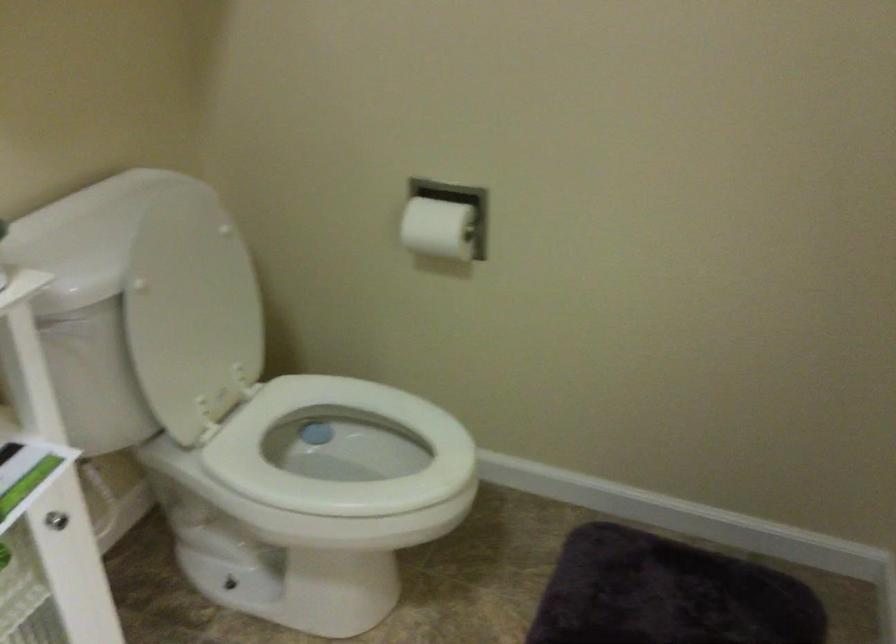
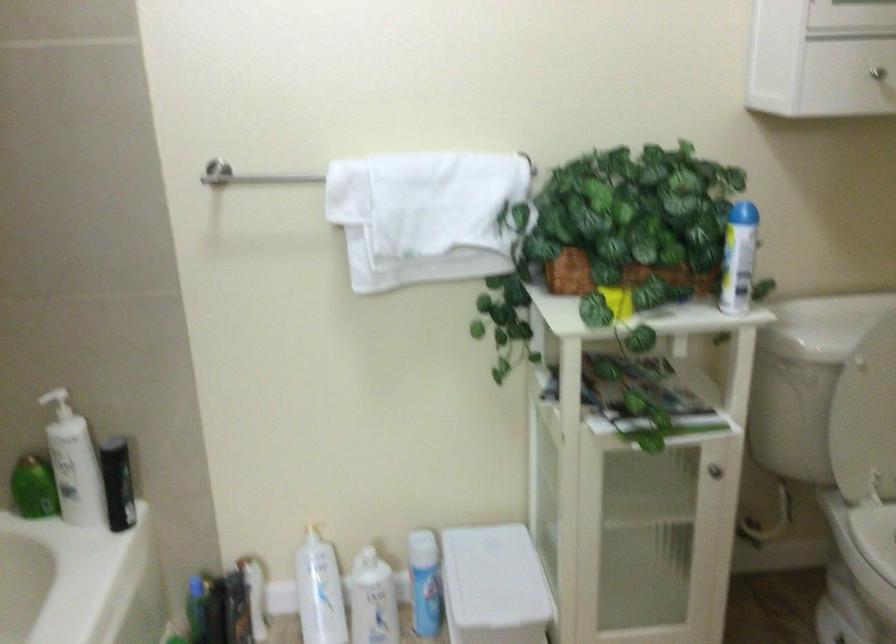
Question: How did the camera likely rotate?

Choices:
 (A) Left
 (B) Right
 (C) Up
 (D) Down

Answer: (A)